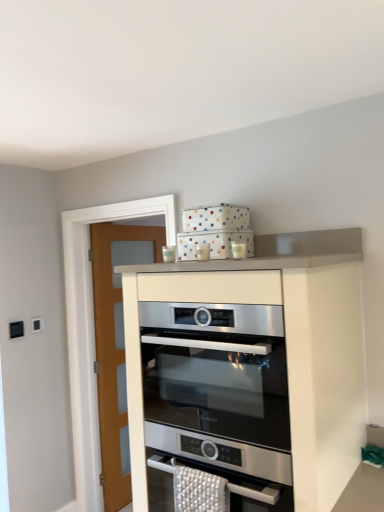
Measure the distance between satin white oven at upper center and camera.

They are 1.29 meters apart.

The height and width of the screenshot is (512, 384). I want to click on satin white oven at upper center, so click(249, 368).

What do you see at coordinates (249, 368) in the screenshot?
I see `satin white oven at upper center` at bounding box center [249, 368].

What do you see at coordinates (217, 371) in the screenshot? This screenshot has height=512, width=384. I see `stainless steel oven at center` at bounding box center [217, 371].

In order to face stainless steel oven at center, should I rotate leftwards or rightwards?

To face it directly, rotate right by 6.583 degrees.

I want to click on stainless steel oven at center, so click(x=217, y=371).

Find the location of a particular element. satin white oven at upper center is located at coordinates coord(249,368).

Does stainless steel oven at center appear on the right side of satin white oven at upper center?

Incorrect, stainless steel oven at center is not on the right side of satin white oven at upper center.

Is stainless steel oven at center positioned in front of satin white oven at upper center?

No, stainless steel oven at center is behind satin white oven at upper center.

Is point (166, 381) less distant than point (282, 303)?

No, (166, 381) is further to viewer.

From the image's perspective, which one is positioned lower, stainless steel oven at center or satin white oven at upper center?

satin white oven at upper center, from the image's perspective.

From a real-world perspective, is stainless steel oven at center positioned above or below satin white oven at upper center?

stainless steel oven at center is above satin white oven at upper center.

Is stainless steel oven at center thinner than satin white oven at upper center?

In fact, stainless steel oven at center might be wider than satin white oven at upper center.

Can you confirm if stainless steel oven at center is taller than satin white oven at upper center?

Incorrect, the height of stainless steel oven at center is not larger of that of satin white oven at upper center.

Can you confirm if stainless steel oven at center is smaller than satin white oven at upper center?

Yes, stainless steel oven at center is smaller than satin white oven at upper center.

Which is correct: stainless steel oven at center is inside satin white oven at upper center, or outside of it?

stainless steel oven at center fits inside satin white oven at upper center.

Is stainless steel oven at center in contact with satin white oven at upper center?

Indeed, stainless steel oven at center and satin white oven at upper center are beside each other and touching.

Based on the photo, could you tell me if stainless steel oven at center is facing satin white oven at upper center?

Yes, stainless steel oven at center is aimed at satin white oven at upper center.

How many degrees apart are the facing directions of stainless steel oven at center and satin white oven at upper center?

0.797 degrees.

The height and width of the screenshot is (512, 384). I want to click on cabinetry on the right side of stainless steel oven at center, so click(249, 368).

Based on their positions, is satin white oven at upper center located to the left or right of stainless steel oven at center?

Answer: Clearly, satin white oven at upper center is on the right of stainless steel oven at center in the image.

Which object is further away from the camera taking this photo, satin white oven at upper center or stainless steel oven at center?

stainless steel oven at center is more distant.

Does point (292, 471) come closer to viewer compared to point (200, 421)?

Yes.

From the image's perspective, relative to stainless steel oven at center, is satin white oven at upper center above or below?

Based on their image positions, satin white oven at upper center is located beneath stainless steel oven at center.

From a real-world perspective, is satin white oven at upper center located beneath stainless steel oven at center?

Yes, from a real-world perspective, satin white oven at upper center is beneath stainless steel oven at center.

Does satin white oven at upper center have a greater width compared to stainless steel oven at center?

In fact, satin white oven at upper center might be narrower than stainless steel oven at center.

Who is shorter, satin white oven at upper center or stainless steel oven at center?

Standing shorter between the two is stainless steel oven at center.

Does satin white oven at upper center have a larger size compared to stainless steel oven at center?

Yes.

Could stainless steel oven at center be considered to be inside satin white oven at upper center?

Absolutely, stainless steel oven at center is inside satin white oven at upper center.

Are satin white oven at upper center and stainless steel oven at center located far from each other?

satin white oven at upper center is near stainless steel oven at center, not far away.

Is satin white oven at upper center facing towards stainless steel oven at center?

Yes, satin white oven at upper center is facing stainless steel oven at center.

How many degrees apart are the facing directions of satin white oven at upper center and stainless steel oven at center?

0.797 degrees.

Locate an element on the screen. oven positioned vertically above the satin white oven at upper center (from a real-world perspective) is located at coordinates (217, 371).

Find the location of a particular element. This screenshot has height=512, width=384. cabinetry that is under the stainless steel oven at center (from a real-world perspective) is located at coordinates pyautogui.click(x=249, y=368).

Identify the location of oven on the left of satin white oven at upper center. (217, 371).